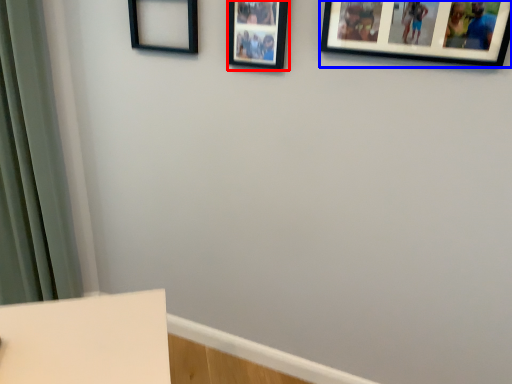
Question: Which object is closer to the camera taking this photo, picture frame (highlighted by a red box) or picture frame (highlighted by a blue box)?

Choices:
 (A) picture frame
 (B) picture frame

Answer: (B)